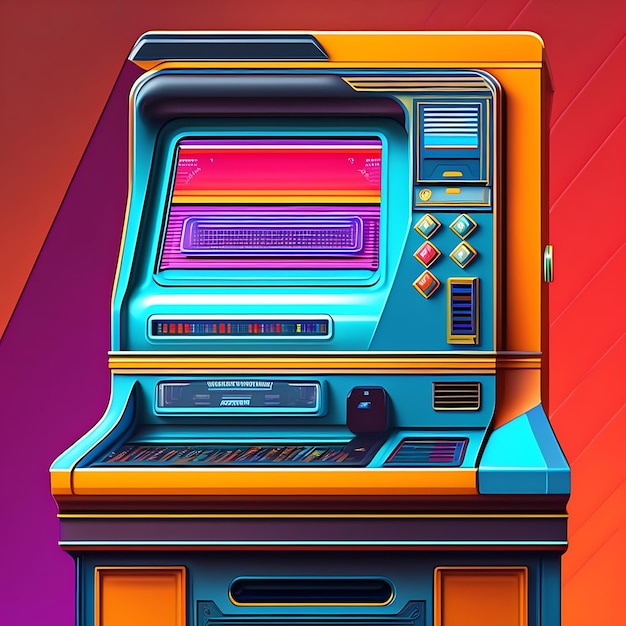
At what (x,y) coordinates should I click in order to perform the action: click on wall. Please return your answer as a coordinate pair (x, y). Looking at the image, I should click on (86, 273).